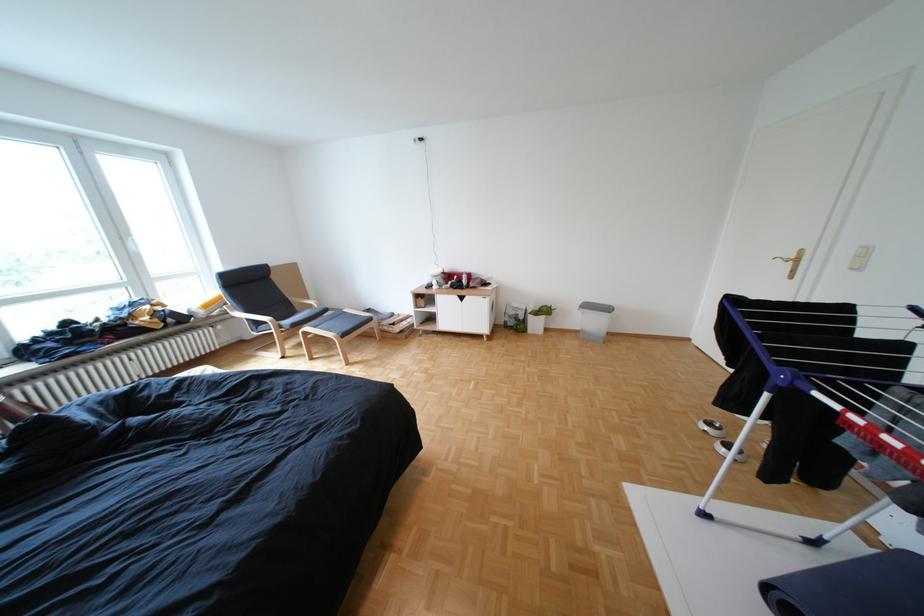
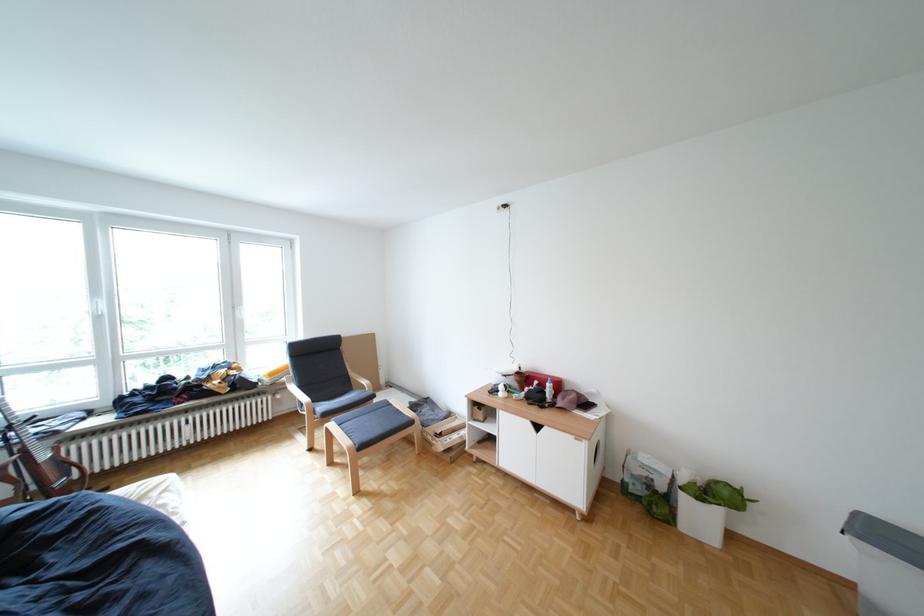
In the second image, find the point that corresponds to [342,310] in the first image.

(388, 397)